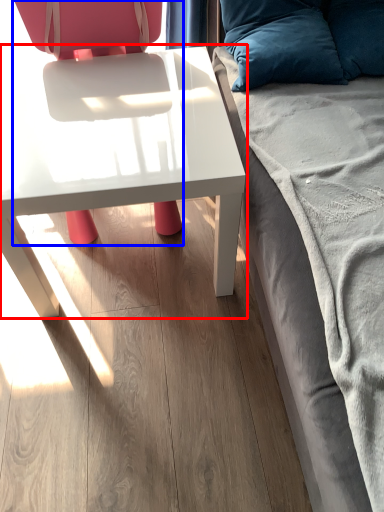
Question: Which object appears farthest to the camera in this image, table (highlighted by a red box) or chair (highlighted by a blue box)?

Choices:
 (A) table
 (B) chair

Answer: (A)